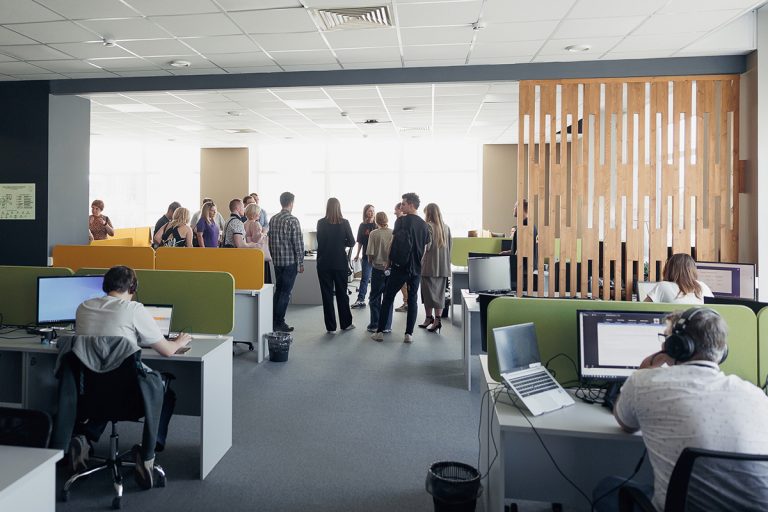
Find the location of `desks`. desks is located at coordinates (220, 380), (263, 314), (308, 272), (457, 284), (467, 311), (557, 447).